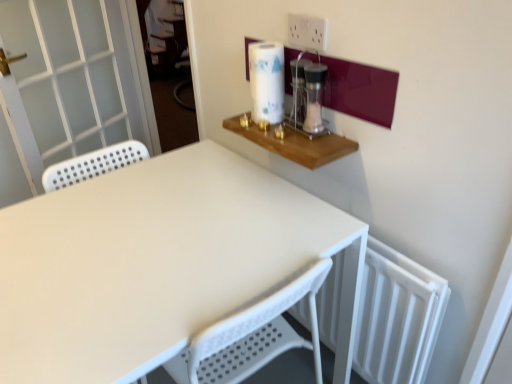
Question: Is white matte table at center smaller than white plastic electric outlet at upper center?

Choices:
 (A) no
 (B) yes

Answer: (A)

Question: Is white matte table at center taller than white plastic electric outlet at upper center?

Choices:
 (A) yes
 (B) no

Answer: (A)

Question: From the image's perspective, is white matte table at center above white plastic electric outlet at upper center?

Choices:
 (A) yes
 (B) no

Answer: (B)

Question: Is white matte table at center further to the viewer compared to white plastic electric outlet at upper center?

Choices:
 (A) no
 (B) yes

Answer: (A)

Question: From a real-world perspective, is white matte table at center beneath white plastic electric outlet at upper center?

Choices:
 (A) no
 (B) yes

Answer: (B)

Question: Is white matte table at center oriented away from white plastic electric outlet at upper center?

Choices:
 (A) no
 (B) yes

Answer: (A)

Question: Is clear glass jar at upper right turned away from white matte table at center?

Choices:
 (A) no
 (B) yes

Answer: (A)

Question: Is white matte table at center a part of clear glass jar at upper right?

Choices:
 (A) no
 (B) yes

Answer: (A)

Question: Considering the relative sizes of clear glass jar at upper right and white matte table at center in the image provided, is clear glass jar at upper right shorter than white matte table at center?

Choices:
 (A) yes
 (B) no

Answer: (A)

Question: Is clear glass jar at upper right not near white matte table at center?

Choices:
 (A) no
 (B) yes

Answer: (A)

Question: Can you see clear glass jar at upper right touching white matte table at center?

Choices:
 (A) yes
 (B) no

Answer: (B)

Question: Can we say clear glass jar at upper right lies outside white matte table at center?

Choices:
 (A) yes
 (B) no

Answer: (A)

Question: From a real-world perspective, is white glossy paper towel at upper right on top of white perforated screen door at left?

Choices:
 (A) yes
 (B) no

Answer: (A)